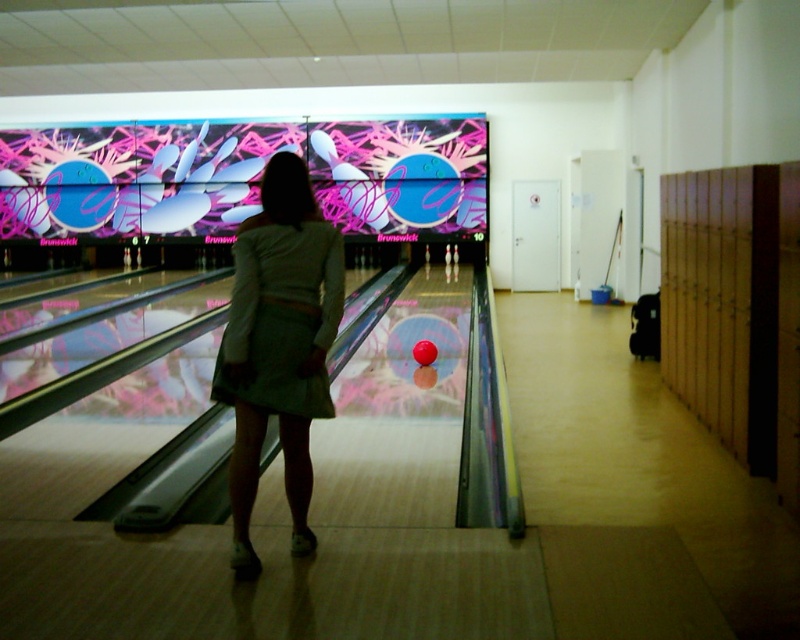
Question: Which of the following is the farthest from the observer?

Choices:
 (A) (420, 364)
 (B) (245, 275)

Answer: (A)

Question: Which of the following is the farthest from the observer?

Choices:
 (A) (234, 380)
 (B) (252, 301)
 (C) (424, 353)

Answer: (C)

Question: Is the position of green fabric dress at center less distant than that of matte red bowling ball at center?

Choices:
 (A) yes
 (B) no

Answer: (A)

Question: Based on their relative distances, which object is farther from the matte red bowling ball at center?

Choices:
 (A) white cotton dress at center
 (B) green fabric dress at center

Answer: (B)

Question: Is white cotton dress at center below matte red bowling ball at center?

Choices:
 (A) yes
 (B) no

Answer: (B)

Question: Does white cotton dress at center have a lesser width compared to matte red bowling ball at center?

Choices:
 (A) no
 (B) yes

Answer: (A)